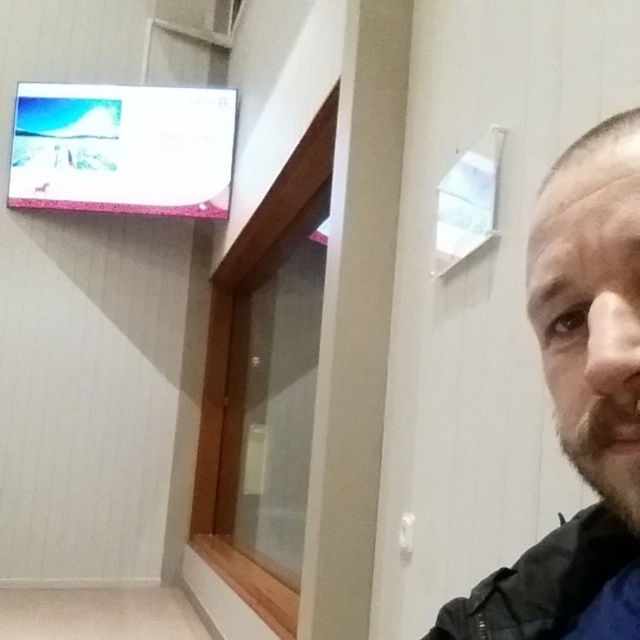
You are a tailor measuring the width of the black matte jacket at lower right and the brown fuzzy beard at lower right. Which object is wider?

The black matte jacket at lower right might be wider than brown fuzzy beard at lower right according to the description.

You are an interior designer assessing the placement of the TV in this room. The bearded man at right and the brown fuzzy beard at lower right are both in the frame. Which object is positioned lower in the image?

The brown fuzzy beard at lower right is positioned lower than the bearded man at right.

You are standing in the room and want to determine which of the two points, point (x=595, y=232) or point (x=561, y=561), is closer to you. Based on the scene description, which point is nearer?

Point (x=595, y=232) is closer to the camera than point (x=561, y=561), so it is nearer to you.